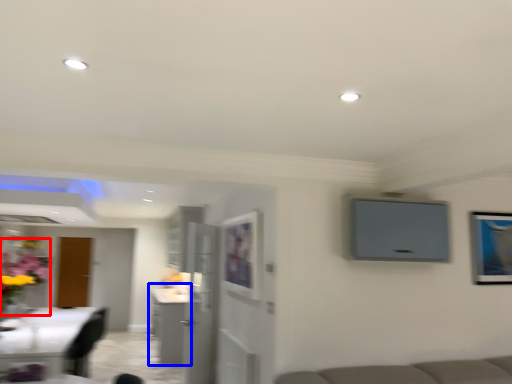
Question: Among these objects, which one is farthest to the camera, floral arrangement (highlighted by a red box) or cabinetry (highlighted by a blue box)?

Choices:
 (A) floral arrangement
 (B) cabinetry

Answer: (B)